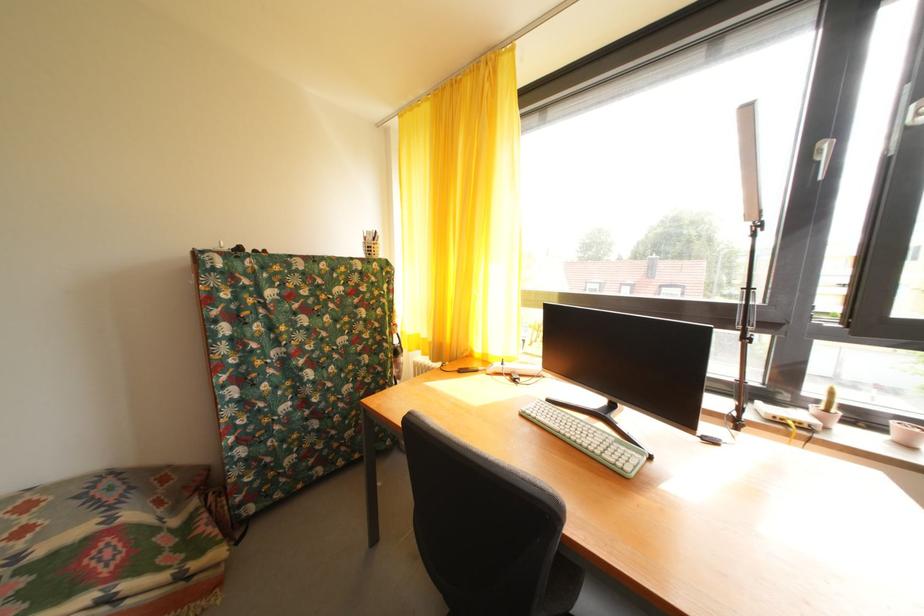
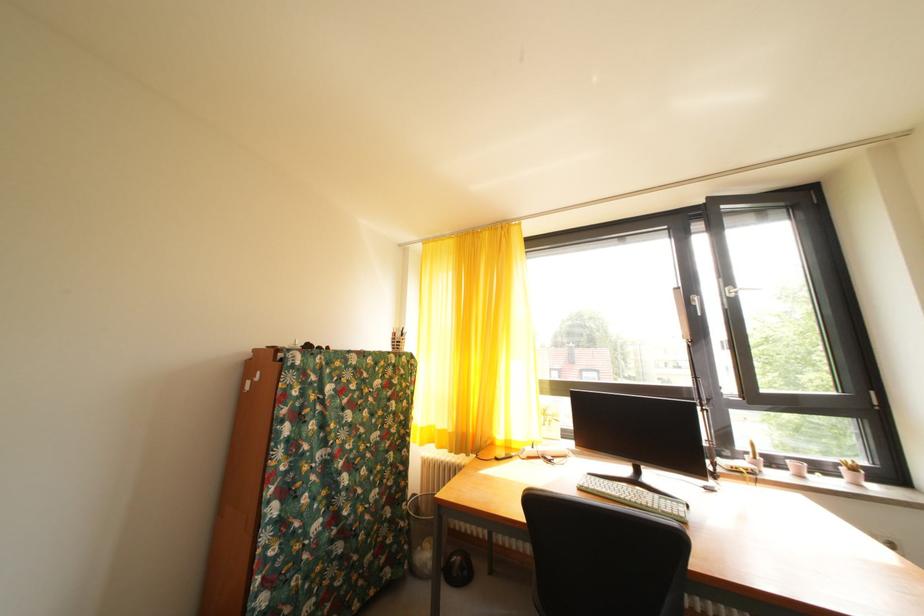
What movement of the cameraman would produce the second image?

The cameraman moved toward left, backward.